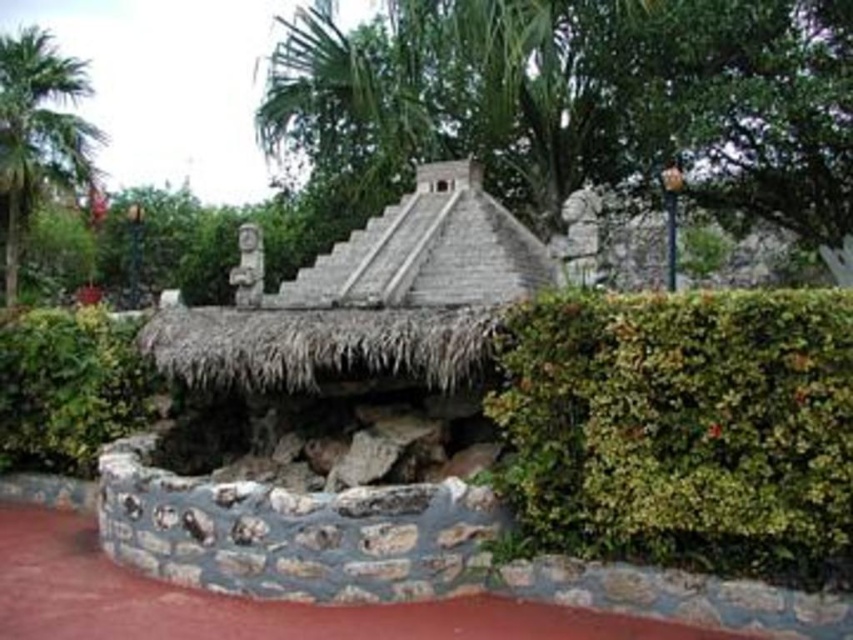
Is green leafy tree at center to the right of green leafy hedge at left from the viewer's perspective?

Correct, you'll find green leafy tree at center to the right of green leafy hedge at left.

Is green leafy tree at center positioned at the back of green leafy hedge at left?

Yes.

Who is more forward, (x=515, y=6) or (x=80, y=468)?

Point (x=80, y=468)

This screenshot has width=853, height=640. Find the location of `green leafy tree at center`. green leafy tree at center is located at coordinates (583, 100).

Who is positioned more to the left, green leafy hedge at right or green leafy hedge at left?

Positioned to the left is green leafy hedge at left.

Is point (730, 296) behind point (105, 394)?

That is False.

Is point (682, 352) closer to camera compared to point (84, 458)?

Yes, it is.

This screenshot has height=640, width=853. Identify the location of green leafy hedge at right. (683, 428).

Who is positioned more to the left, green leafy tree at center or green leafy palm tree at left?

From the viewer's perspective, green leafy palm tree at left appears more on the left side.

Is green leafy tree at center taller than green leafy palm tree at left?

Yes.

Does point (503, 29) come closer to viewer compared to point (25, 161)?

Yes, point (503, 29) is closer to viewer.

Where is `green leafy tree at center`? Image resolution: width=853 pixels, height=640 pixels. green leafy tree at center is located at coordinates [x=583, y=100].